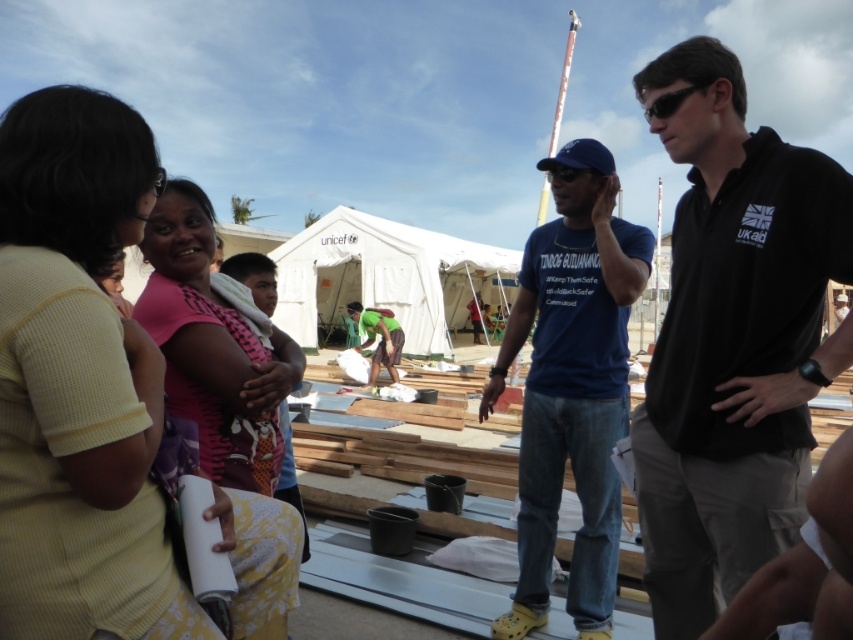
Question: Which point is closer to the camera?

Choices:
 (A) blue cotton shirt at center
 (B) green fabric shirt at center
 (C) black smooth polo shirt at center

Answer: (C)

Question: Can you confirm if yellow textured shirt at upper left is positioned above black smooth polo shirt at center?

Choices:
 (A) no
 (B) yes

Answer: (A)

Question: Is blue cotton shirt at center to the left of green fabric shirt at center from the viewer's perspective?

Choices:
 (A) no
 (B) yes

Answer: (A)

Question: In this image, where is yellow textured shirt at upper left located relative to black smooth polo shirt at center?

Choices:
 (A) right
 (B) left

Answer: (B)

Question: Among these objects, which one is nearest to the camera?

Choices:
 (A) green fabric shirt at center
 (B) yellow textured shirt at upper left
 (C) black smooth polo shirt at center
 (D) blue cotton shirt at center

Answer: (B)

Question: Which of the following is the closest to the observer?

Choices:
 (A) (47, 161)
 (B) (397, 380)
 (C) (601, 173)
 (D) (670, 372)

Answer: (A)